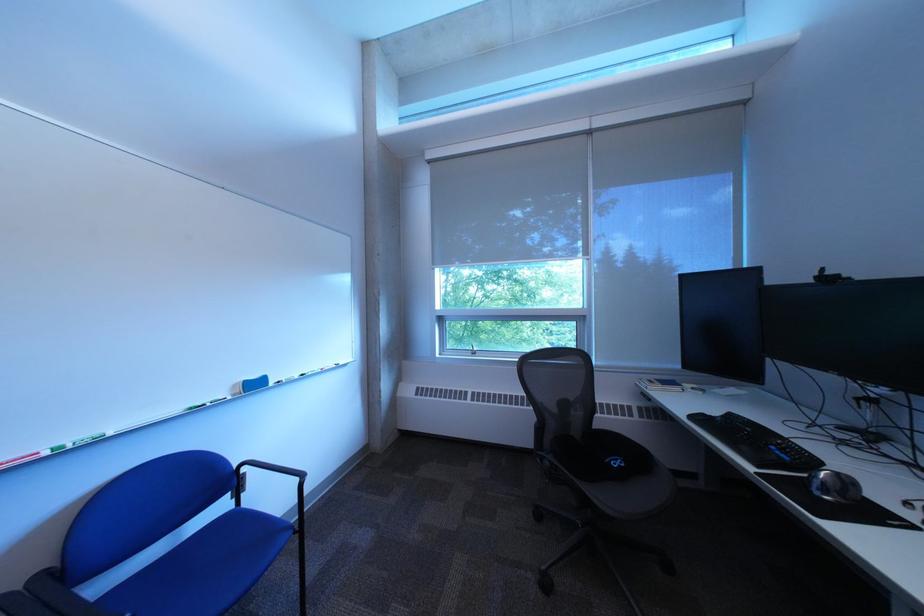
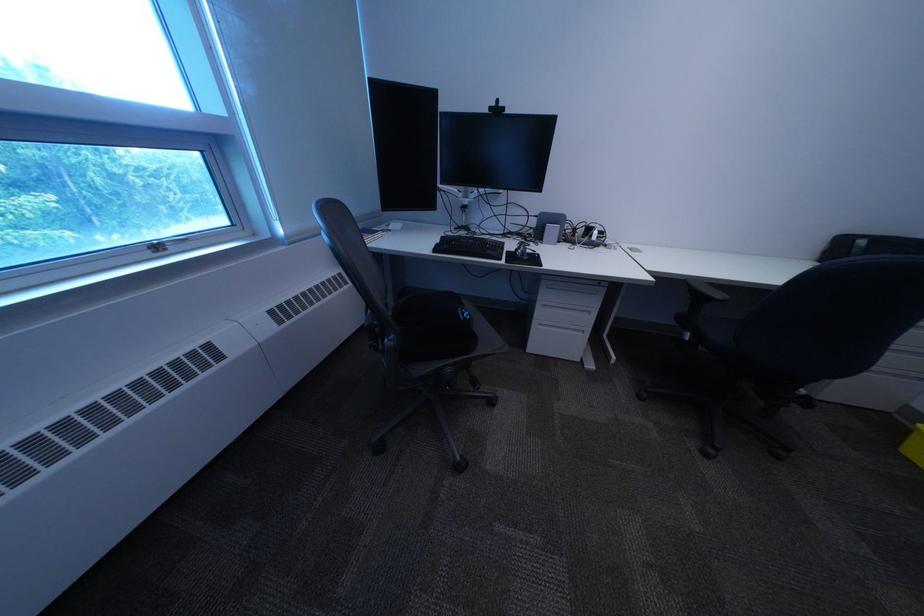
Locate, in the second image, the point that corresponds to (x=827, y=283) in the first image.

(503, 113)